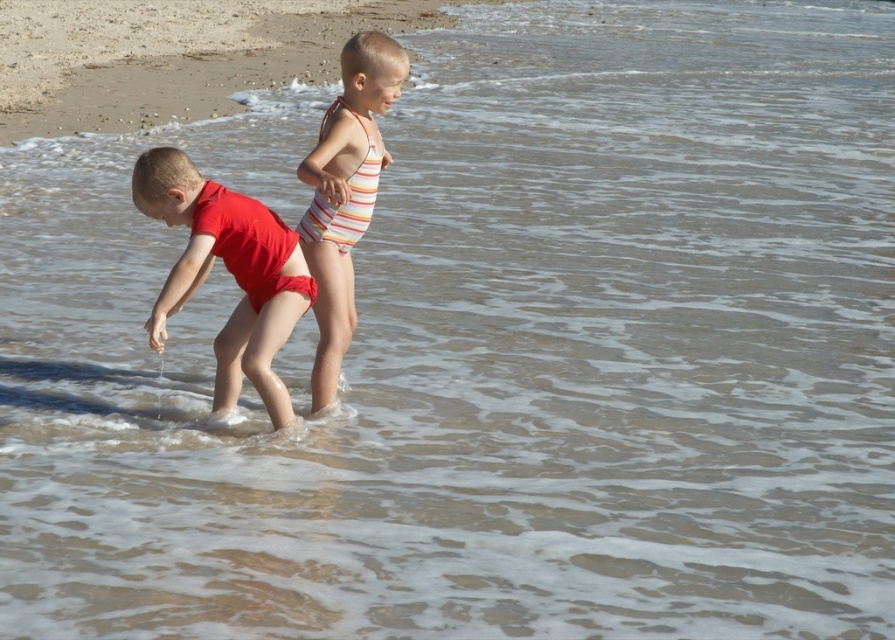
Question: Does matte red swimsuit at left appear under striped fabric swimsuit at center?

Choices:
 (A) no
 (B) yes

Answer: (B)

Question: From the image, what is the correct spatial relationship of matte red swimsuit at left in relation to striped fabric swimsuit at center?

Choices:
 (A) right
 (B) left

Answer: (B)

Question: Among these points, which one is farthest from the camera?

Choices:
 (A) (350, 182)
 (B) (243, 324)

Answer: (B)

Question: Does matte red swimsuit at left lie in front of striped fabric swimsuit at center?

Choices:
 (A) yes
 (B) no

Answer: (A)